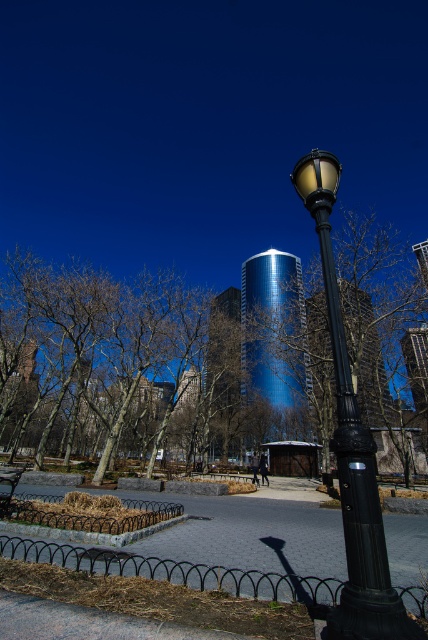
You are standing at the point marked by the coordinates point (351, 449) in the park. What object are you standing at?

You are standing at the black polished metal street light at right, which is represented by point (351, 449).

You are a visitor in the park and want to sit on the wooden park bench at lower left. To get there from the black polished metal street light at right, which direction should you move?

To reach the wooden park bench at lower left from the black polished metal street light at right, you should move to the left since the street light is positioned to the right of the bench.

You are a park maintenance worker and need to place a 4 meter long ladder between the two closest bare branches at center. Will the ladder fit between them?

The two closest bare branches at center are 3.74 meters apart, so the 4 meter long ladder will not fit between them as it is longer than the space available.